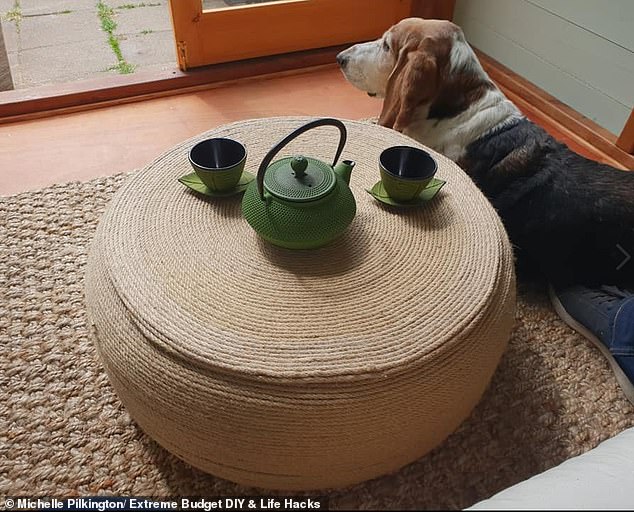
In order to click on cup in this screenshot , I will do `click(220, 173)`, `click(401, 179)`.